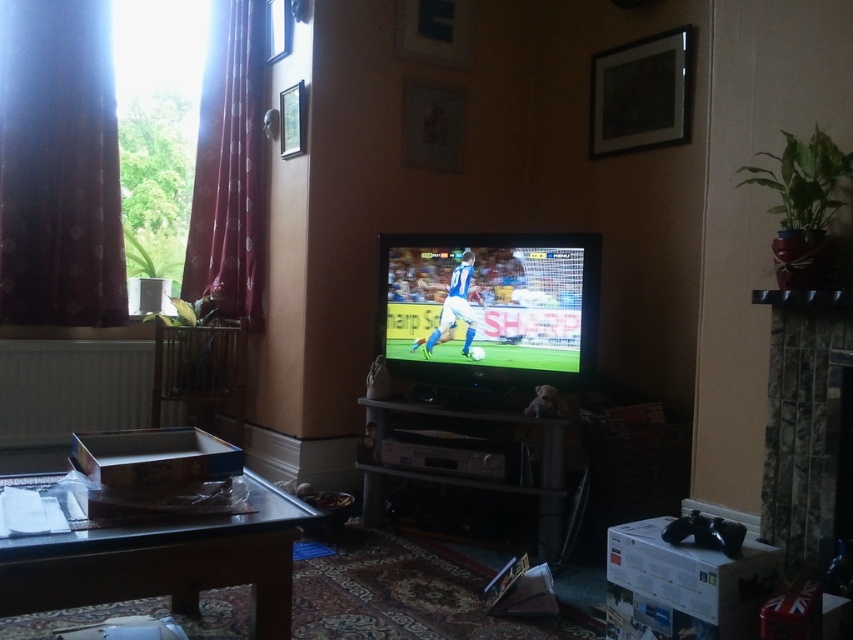
You are planning to place a large potted plant on either the wooden table at lower left or the marble fireplace at right. Based on their sizes, which surface can accommodate the plant more comfortably?

The wooden table at lower left is larger in size than the marble fireplace at right, so the wooden table at lower left can accommodate the plant more comfortably.

You are a delivery person who needs to place a 1.5 meter long package between the wooden table at lower left and the marble fireplace at right. Is there enough space to fit it horizontally?

The wooden table at lower left is 1.31 meters away from the marble fireplace at right. Since the package is 1.5 meters long, which is longer than the distance between them, it cannot fit horizontally between the wooden table at lower left and the marble fireplace at right.

You are standing in the living room and want to walk from the dark red velvet curtain at left to the marble fireplace at right. Which direction should you move towards?

You should move towards the right side of the room since the dark red velvet curtain at left is further to the viewer than the marble fireplace at right, meaning the fireplace is positioned to the right and behind the curtain.